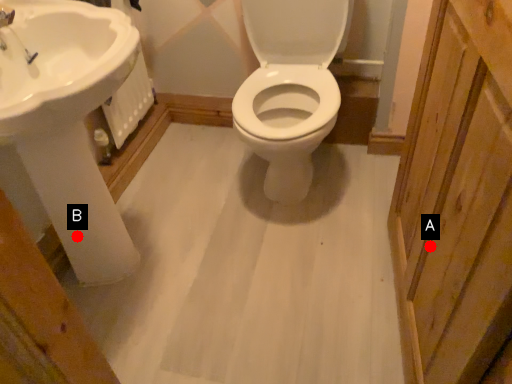
Question: Two points are circled on the image, labeled by A and B beside each circle. Among these points, which one is farthest from the camera?

Choices:
 (A) A is further
 (B) B is further

Answer: (B)